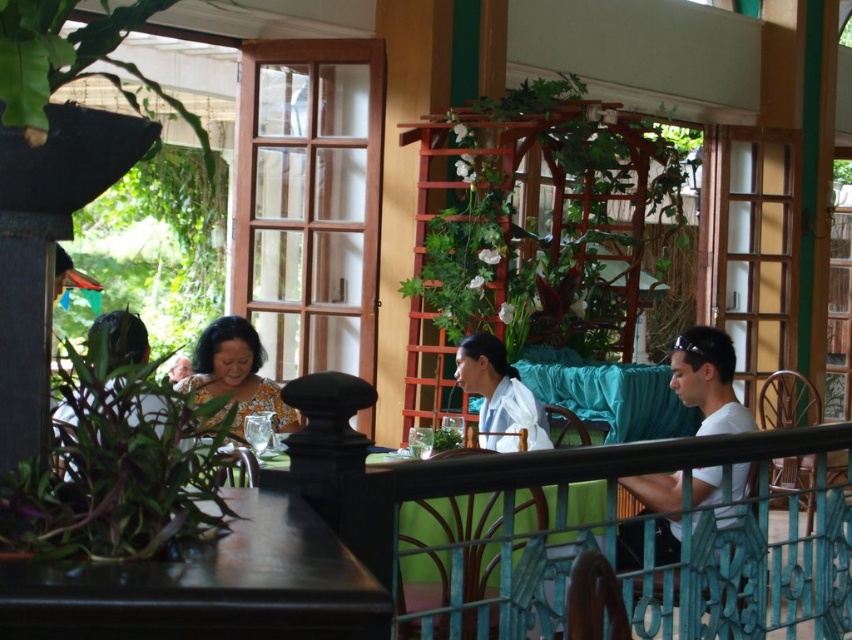
Question: Which point is closer to the camera?

Choices:
 (A) wooden trellis with climbing plants at center
 (B) white matte shirt at right

Answer: (B)

Question: Observing the image, what is the correct spatial positioning of wooden trellis with climbing plants at center in reference to printed fabric blouse at center?

Choices:
 (A) left
 (B) right

Answer: (B)

Question: Where is dark brown wood table at lower left located in relation to white fabric shirt at center in the image?

Choices:
 (A) above
 (B) below

Answer: (A)

Question: Which point appears farthest from the camera in this image?

Choices:
 (A) (721, 368)
 (B) (471, 333)
 (C) (410, 138)
 (D) (329, 534)

Answer: (C)

Question: Does wooden trellis with climbing plants at center have a lesser width compared to white fabric shirt at center?

Choices:
 (A) no
 (B) yes

Answer: (A)

Question: Which of the following is the farthest from the observer?

Choices:
 (A) white matte shirt at right
 (B) printed fabric blouse at center
 (C) white fabric shirt at center
 (D) wooden trellis with climbing plants at center

Answer: (D)